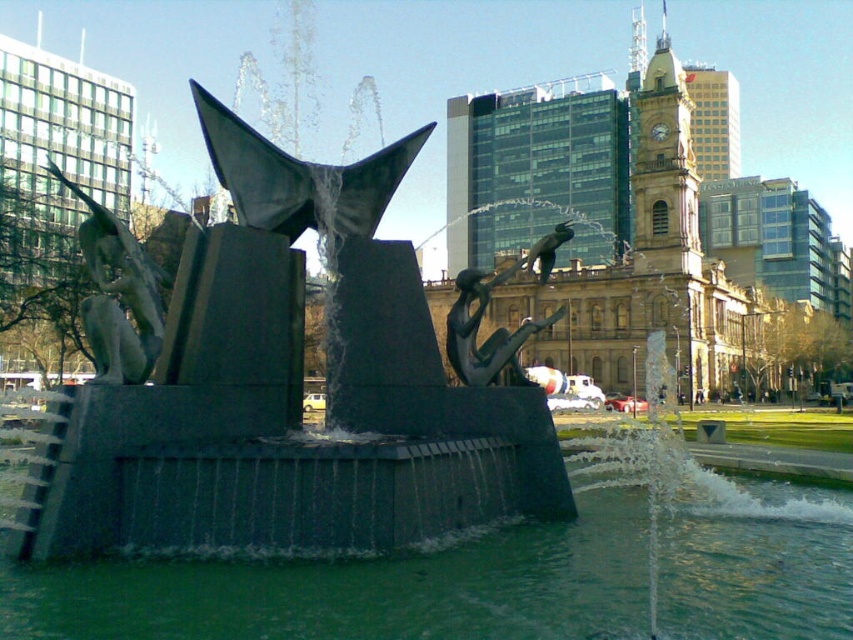
You are an art student analyzing the fountain sculpture. You notice two statues in the scene. Which one is wider, the polished bronze statue at left or the bronze textured figure at center?

The polished bronze statue at left is wider than the bronze textured figure at center.

You are standing in front of the fountain sculpture and want to take a photo of both the polished bronze statue at left and the bronze textured figure at center. Which statue should you focus on first to ensure both are in clear view?

You should focus on the polished bronze statue at left first because it is closer to the viewer than the bronze textured figure at center, so adjusting focus from near to far will help capture both clearly.

You are a city planner evaluating the fountain area. You need to install a new light post that must be placed where the green water at fountain center and the polished bronze statue at left are both visible. Considering their heights, which object should the light post be positioned closer to?

The light post should be positioned closer to the polished bronze statue at left because the green water at fountain center has a lesser height. This ensures both objects are visible as the statue is taller and can be seen from a distance.